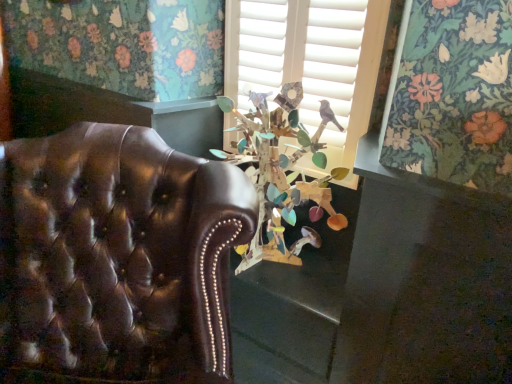
The width and height of the screenshot is (512, 384). I want to click on wooden birdhouse at center, so click(x=310, y=59).

What is the approximate height of shiny brown leather chair at left?

shiny brown leather chair at left is 3.40 feet in height.

The height and width of the screenshot is (384, 512). Find the location of `wooden birdhouse at center`. wooden birdhouse at center is located at coordinates (280, 173).

Which is behind, point (86, 339) or point (323, 183)?

The point (323, 183) is farther.

Is shiny brown leather chair at left shorter than wooden birdhouse at center?

No.

Between shiny brown leather chair at left and wooden birdhouse at center, which one appears on the left side from the viewer's perspective?

From the viewer's perspective, shiny brown leather chair at left appears more on the left side.

From the image's perspective, is shiny brown leather chair at left located above or below wooden birdhouse at center?

shiny brown leather chair at left is below wooden birdhouse at center.

Which is less distant, (x=204, y=304) or (x=348, y=132)?

Point (x=204, y=304) appears to be closer to the viewer than point (x=348, y=132).

Between shiny brown leather chair at left and wooden birdhouse at center, which one is positioned behind?

wooden birdhouse at center is more distant.

Find the location of a particular element. This screenshot has height=384, width=512. chair directly beneath the wooden birdhouse at center (from a real-world perspective) is located at coordinates (x=117, y=258).

Would you consider wooden birdhouse at center to be distant from wooden birdhouse at center?

Actually, wooden birdhouse at center and wooden birdhouse at center are a little close together.

Considering the positions of point (254, 13) and point (291, 129), is point (254, 13) closer or farther from the camera than point (291, 129)?

Point (254, 13).

Looking at their sizes, would you say wooden birdhouse at center is wider or thinner than wooden birdhouse at center?

In the image, wooden birdhouse at center appears to be more narrow than wooden birdhouse at center.

In the scene shown: From the image's perspective, who appears lower, wooden birdhouse at center or wooden birdhouse at center?

wooden birdhouse at center is shown below in the image.

From the picture: From the image's perspective, is wooden birdhouse at center positioned above or below shiny brown leather chair at left?

Based on their image positions, wooden birdhouse at center is located above shiny brown leather chair at left.

Which object is thinner, wooden birdhouse at center or shiny brown leather chair at left?

With smaller width is wooden birdhouse at center.

Looking at this image, would you say wooden birdhouse at center is outside shiny brown leather chair at left?

wooden birdhouse at center is positioned outside shiny brown leather chair at left.

Which is behind, wooden birdhouse at center or shiny brown leather chair at left?

wooden birdhouse at center is further away from the camera.

Is wooden birdhouse at center facing away from shiny brown leather chair at left?

wooden birdhouse at center does not have its back to shiny brown leather chair at left.

Identify the location of window above the shiny brown leather chair at left (from the image's perspective). Image resolution: width=512 pixels, height=384 pixels. (310, 59).

Which is more to the left, wooden birdhouse at center or shiny brown leather chair at left?

Positioned to the left is shiny brown leather chair at left.

Is wooden birdhouse at center completely or partially outside of shiny brown leather chair at left?

Yes.

Considering the positions of objects wooden birdhouse at center and wooden birdhouse at center in the image provided, who is behind, wooden birdhouse at center or wooden birdhouse at center?

Positioned behind is wooden birdhouse at center.

Can you see wooden birdhouse at center touching wooden birdhouse at center?

No, wooden birdhouse at center is not with wooden birdhouse at center.

From the image's perspective, which one is positioned higher, wooden birdhouse at center or wooden birdhouse at center?

wooden birdhouse at center, from the image's perspective.

How distant is wooden birdhouse at center from wooden birdhouse at center?

A distance of 5.46 inches exists between wooden birdhouse at center and wooden birdhouse at center.

You are a GUI agent. You are given a task and a screenshot of the screen. Output one action in this format:
    pyautogui.click(x=<x>, y=<y>)
    Task: Click on the floral arrangement on the right of shiny brown leather chair at left
    The height and width of the screenshot is (384, 512).
    Given the screenshot: What is the action you would take?
    pyautogui.click(x=280, y=173)

In order to click on chair below the wooden birdhouse at center (from the image's perspective) in this screenshot , I will do `click(117, 258)`.

Looking at the image, which one is located further to wooden birdhouse at center, shiny brown leather chair at left or wooden birdhouse at center?

shiny brown leather chair at left lies further to wooden birdhouse at center than the other object.

Estimate the real-world distances between objects in this image. Which object is further from wooden birdhouse at center, shiny brown leather chair at left or wooden birdhouse at center?

shiny brown leather chair at left.

From the image, which object appears to be farther from shiny brown leather chair at left, wooden birdhouse at center or wooden birdhouse at center?

wooden birdhouse at center lies further to shiny brown leather chair at left than the other object.

Which object lies nearer to the anchor point wooden birdhouse at center, wooden birdhouse at center or shiny brown leather chair at left?

wooden birdhouse at center is closer to wooden birdhouse at center.

Estimate the real-world distances between objects in this image. Which object is closer to shiny brown leather chair at left, wooden birdhouse at center or wooden birdhouse at center?

Among the two, wooden birdhouse at center is located nearer to shiny brown leather chair at left.

Considering their positions, is wooden birdhouse at center positioned further to wooden birdhouse at center than shiny brown leather chair at left?

shiny brown leather chair at left lies further to wooden birdhouse at center than the other object.

Identify the location of floral arrangement between shiny brown leather chair at left and wooden birdhouse at center along the z-axis. Image resolution: width=512 pixels, height=384 pixels. (280, 173).